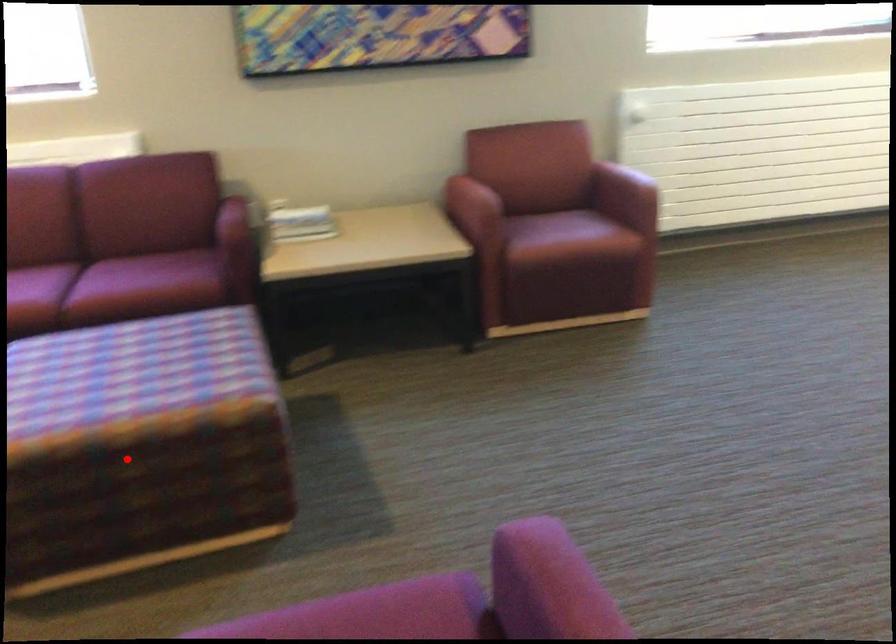
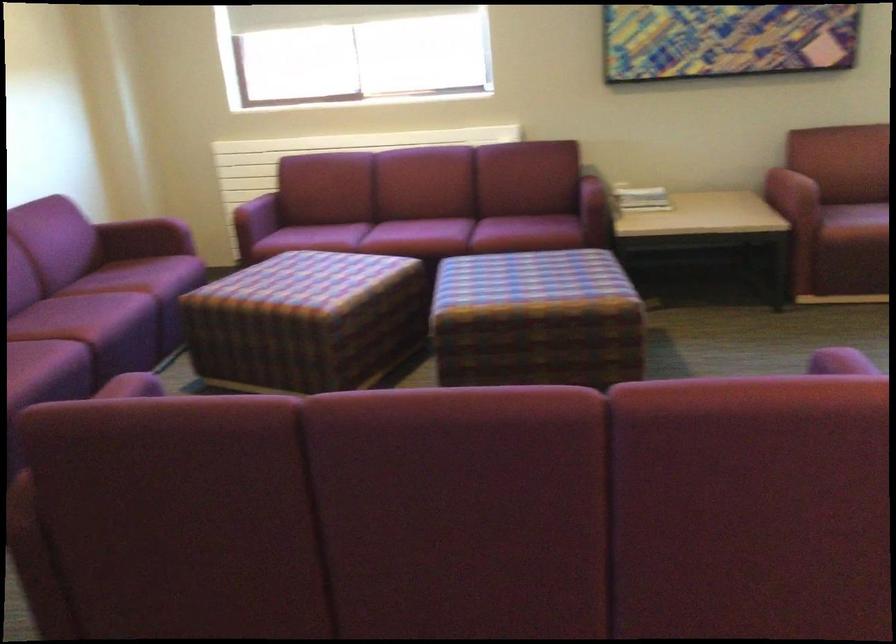
Question: I am providing you with two images of the same scene from different viewpoints. Given a red point in image1, look at the same physical point in image2. Is it:

Choices:
 (A) Closer to the viewpoint
 (B) Farther from the viewpoint

Answer: (B)